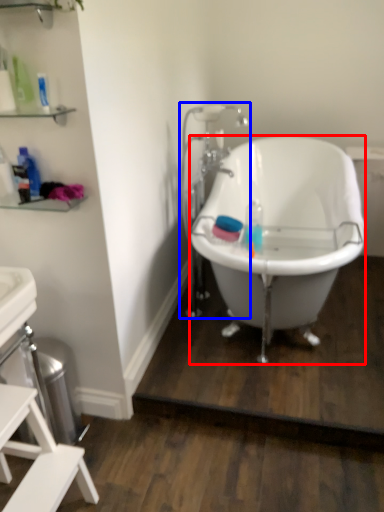
Question: Which point is further to the camera, bathtub (highlighted by a red box) or faucet (highlighted by a blue box)?

Choices:
 (A) bathtub
 (B) faucet

Answer: (B)